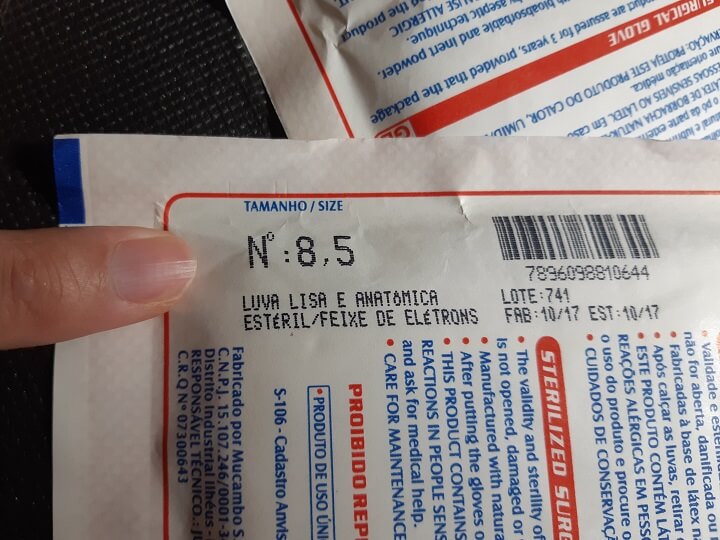
In order to click on table in this screenshot , I will do `click(130, 60)`.